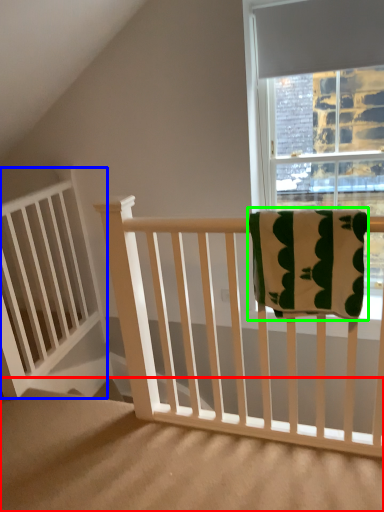
Question: Which is nearer to the stairs (highlighted by a red box)? balustrade (highlighted by a blue box) or beach towel (highlighted by a green box).

Choices:
 (A) balustrade
 (B) beach towel

Answer: (A)